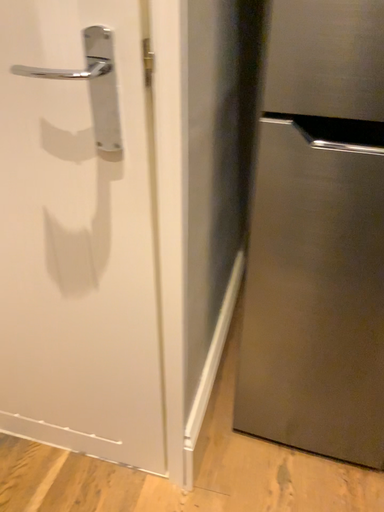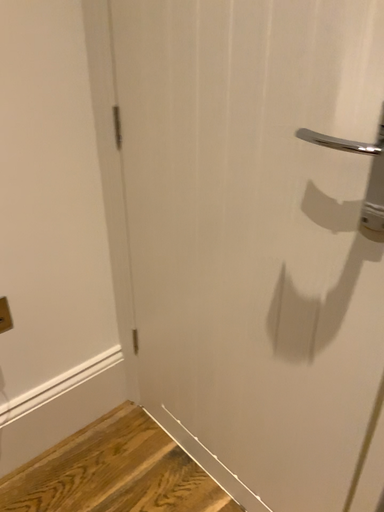
Question: Which way did the camera rotate in the video?

Choices:
 (A) rotated upward
 (B) rotated downward

Answer: (A)